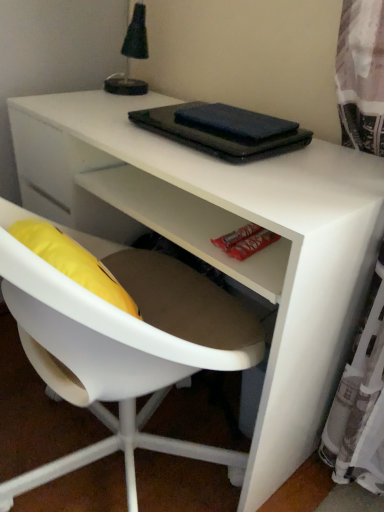
Where is `free space above dark blue matte notebook at upper center, which appears as the first notebook when viewed from the top (from a real-world perspective)`? free space above dark blue matte notebook at upper center, which appears as the first notebook when viewed from the top (from a real-world perspective) is located at coordinates (228, 113).